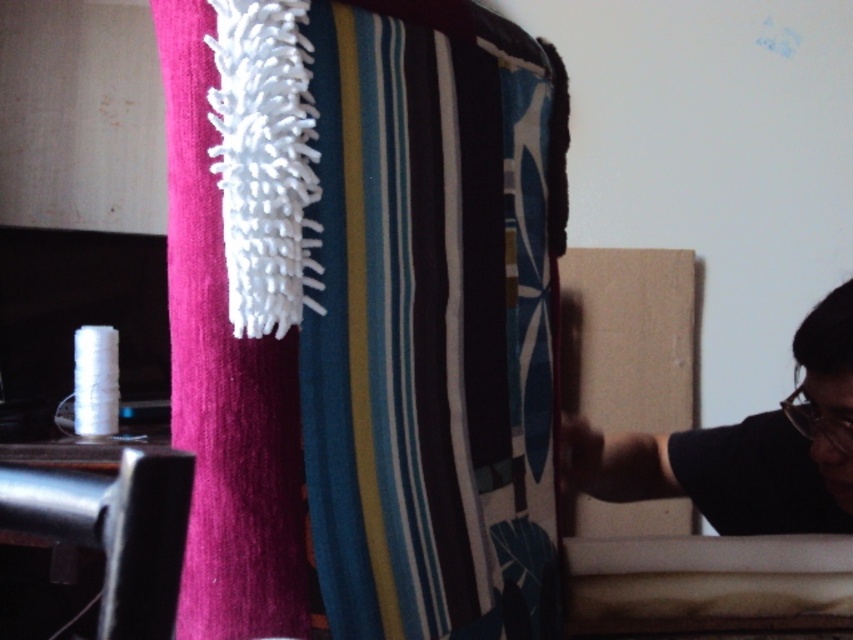
Question: Is striped fabric at center wider than black matte person at right?

Choices:
 (A) yes
 (B) no

Answer: (B)

Question: Based on their relative distances, which object is nearer to the black matte person at right?

Choices:
 (A) white fuzzy brush at left
 (B) striped fabric at center

Answer: (B)

Question: Estimate the real-world distances between objects in this image. Which object is closer to the black matte person at right?

Choices:
 (A) striped fabric at center
 (B) white fuzzy brush at left

Answer: (A)

Question: Where is striped fabric at center located in relation to white fuzzy brush at left in the image?

Choices:
 (A) right
 (B) left

Answer: (A)

Question: Which point is farther from the camera taking this photo?

Choices:
 (A) (508, 241)
 (B) (195, 250)
 (C) (784, 515)

Answer: (C)

Question: In this image, where is striped fabric at center located relative to white fuzzy brush at left?

Choices:
 (A) above
 (B) below

Answer: (B)